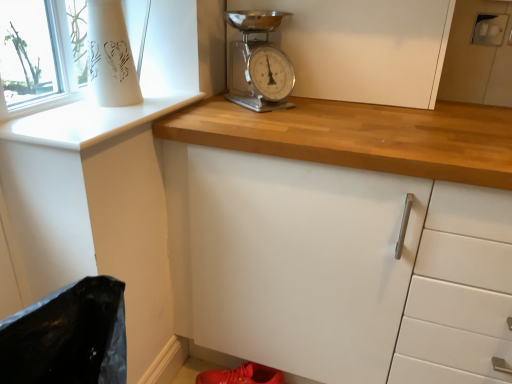
Question: From the image's perspective, is white matte cabinet at center under chrome metallic scale at upper center?

Choices:
 (A) no
 (B) yes

Answer: (A)

Question: Would you consider white matte cabinet at center to be distant from chrome metallic scale at upper center?

Choices:
 (A) no
 (B) yes

Answer: (A)

Question: Considering the relative positions of white matte cabinet at center and chrome metallic scale at upper center in the image provided, is white matte cabinet at center to the left of chrome metallic scale at upper center from the viewer's perspective?

Choices:
 (A) no
 (B) yes

Answer: (A)

Question: Considering the relative sizes of white matte cabinet at center and chrome metallic scale at upper center in the image provided, is white matte cabinet at center shorter than chrome metallic scale at upper center?

Choices:
 (A) yes
 (B) no

Answer: (B)

Question: Could you tell me if white matte cabinet at center is facing chrome metallic scale at upper center?

Choices:
 (A) yes
 (B) no

Answer: (A)

Question: Is point (258, 369) closer or farther from the camera than point (193, 97)?

Choices:
 (A) farther
 (B) closer

Answer: (A)

Question: In terms of width, does shiny red shoe at lower center look wider or thinner when compared to white glossy window sill at upper left?

Choices:
 (A) thin
 (B) wide

Answer: (A)

Question: From their relative heights in the image, would you say shiny red shoe at lower center is taller or shorter than white glossy window sill at upper left?

Choices:
 (A) tall
 (B) short

Answer: (A)

Question: From the image's perspective, is shiny red shoe at lower center above or below white glossy window sill at upper left?

Choices:
 (A) below
 (B) above

Answer: (A)

Question: Considering the positions of white glossy window sill at upper left and shiny red shoe at lower center in the image, is white glossy window sill at upper left wider or thinner than shiny red shoe at lower center?

Choices:
 (A) thin
 (B) wide

Answer: (B)

Question: In the image, is white glossy window sill at upper left on the left side or the right side of shiny red shoe at lower center?

Choices:
 (A) right
 (B) left

Answer: (B)

Question: From a real-world perspective, relative to shiny red shoe at lower center, is white glossy window sill at upper left vertically above or below?

Choices:
 (A) above
 (B) below

Answer: (A)

Question: Do you think white glossy window sill at upper left is within shiny red shoe at lower center, or outside of it?

Choices:
 (A) inside
 (B) outside

Answer: (B)

Question: Visually, is chrome metallic scale at upper center positioned to the left or to the right of white glossy window sill at upper left?

Choices:
 (A) right
 (B) left

Answer: (A)

Question: Which is correct: chrome metallic scale at upper center is inside white glossy window sill at upper left, or outside of it?

Choices:
 (A) outside
 (B) inside

Answer: (A)